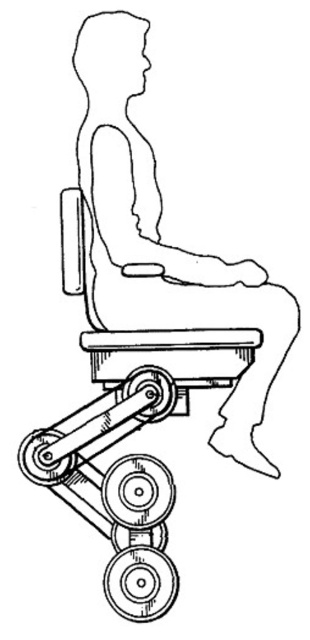
Looking at this image, you are an interior designer planning to place a new sofa in a room. You have a black line drawing of person at center and a matte plastic chair at center in the room. Which object is taller?

The black line drawing of person at center is taller than the matte plastic chair at center.

You are an interior designer planning to place a new sofa in a room. You have a black line drawing of person at center and a matte plastic chair at center in your design. The sofa you want to add is 2.4 inches wide. Can the sofa fit exactly between the two objects?

The distance between the black line drawing of person at center and the matte plastic chair at center is 2.42 inches, so the sofa that is 2.4 inches wide can fit exactly between them with a small amount of space remaining.

You are an interior designer assessing the space requirements for a new seating area. You observe the black line drawing of person at center and the matte plastic chair at center in the image. Which object occupies more horizontal space in the drawing?

The black line drawing of person at center occupies more horizontal space than the matte plastic chair at center because its width is larger.